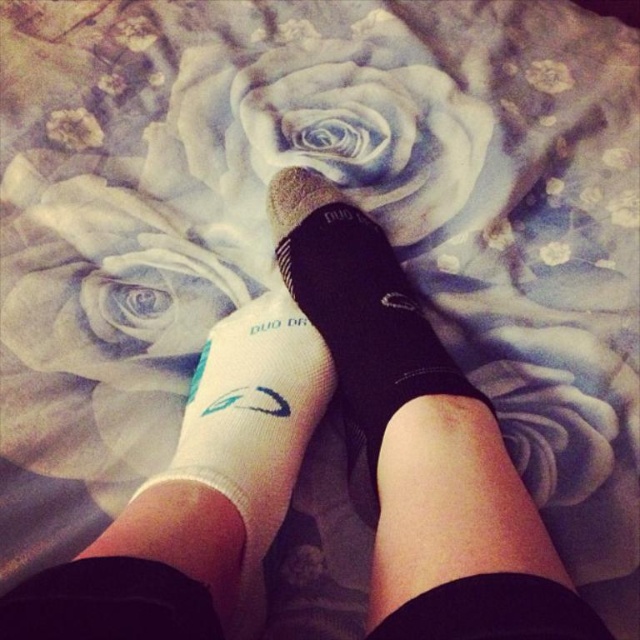
You are a photographer adjusting your camera focus. You notice the white fabric rose at upper center and the white fabric sock at lower center. Which object should you focus on first to ensure it appears sharp in the photo?

The white fabric rose at upper center is closer to the viewer than the white fabric sock at lower center, so you should focus on the white fabric rose at upper center first to ensure it appears sharp.

You are standing in front of the image and notice a point marked at coordinates (420,442). What object is located at that point?

The point at (420,442) is where the black textured socks at center are located.

You are standing in front of the image and want to point to the black textured socks at center. According to the coordinates, where should you point?

You should point to the coordinates point (420,442) because that is the 2D location of the black textured socks at center.